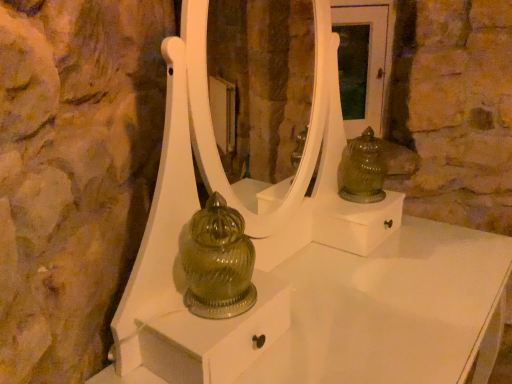
Question: Is white glossy mirror at center further to the viewer compared to green glass figurine at upper right?

Choices:
 (A) no
 (B) yes

Answer: (B)

Question: Is white glossy mirror at center positioned beyond the bounds of green glass figurine at upper right?

Choices:
 (A) yes
 (B) no

Answer: (A)

Question: Can you see white glossy mirror at center touching green glass figurine at upper right?

Choices:
 (A) no
 (B) yes

Answer: (A)

Question: From a real-world perspective, is white glossy mirror at center located higher than green glass figurine at upper right?

Choices:
 (A) no
 (B) yes

Answer: (B)

Question: Does white glossy mirror at center have a greater width compared to green glass figurine at upper right?

Choices:
 (A) no
 (B) yes

Answer: (B)

Question: Does white glossy mirror at center come in front of green glass figurine at upper right?

Choices:
 (A) no
 (B) yes

Answer: (A)

Question: From a real-world perspective, is green glass figurine at upper right beneath white glossy mirror at center?

Choices:
 (A) no
 (B) yes

Answer: (B)

Question: Considering the relative sizes of green glass figurine at upper right and white glossy mirror at center in the image provided, is green glass figurine at upper right smaller than white glossy mirror at center?

Choices:
 (A) yes
 (B) no

Answer: (A)

Question: Is green glass figurine at upper right in front of white glossy mirror at center?

Choices:
 (A) no
 (B) yes

Answer: (B)

Question: Does green glass figurine at upper right have a lesser width compared to white glossy mirror at center?

Choices:
 (A) no
 (B) yes

Answer: (B)

Question: Is white glossy mirror at center located within green glass figurine at upper right?

Choices:
 (A) yes
 (B) no

Answer: (B)

Question: Can you confirm if green glass figurine at upper right is taller than white glossy mirror at center?

Choices:
 (A) yes
 (B) no

Answer: (B)

Question: Is point (240, 137) positioned closer to the camera than point (348, 188)?

Choices:
 (A) closer
 (B) farther

Answer: (B)